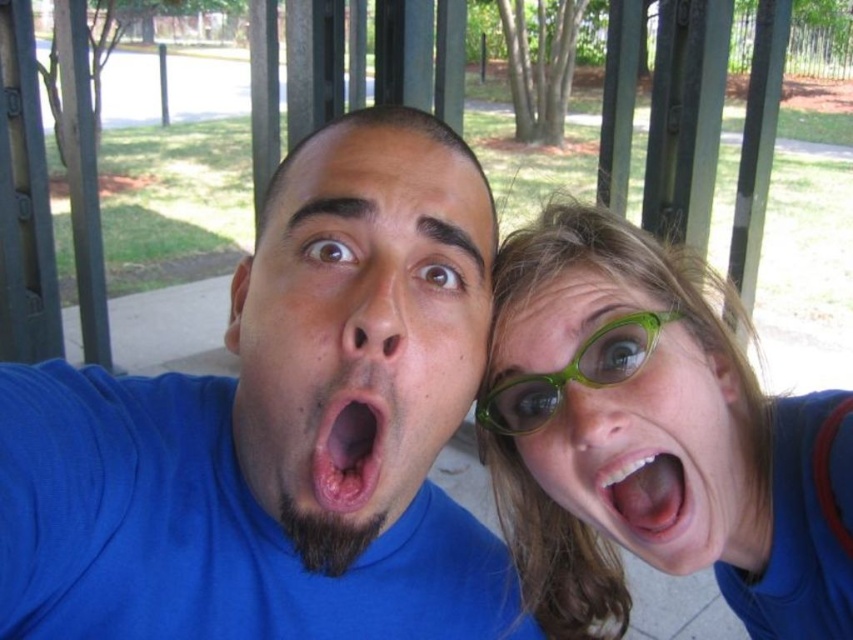
You are a photographer trying to capture a closeup shot of the pink glossy lips at center without the blue matte shirt at center appearing in the frame. Is this possible given their positions?

The blue matte shirt at center might be wider than pink glossy lips at center, so it could block the view. Adjust your angle to ensure the shirt doesn

You are standing at the point closest to the person on the left. Which coordinate point, either point (630, 541) or point (540, 380), is farther away from you?

Point (630, 541) is farther away from you because it is behind point (540, 380).